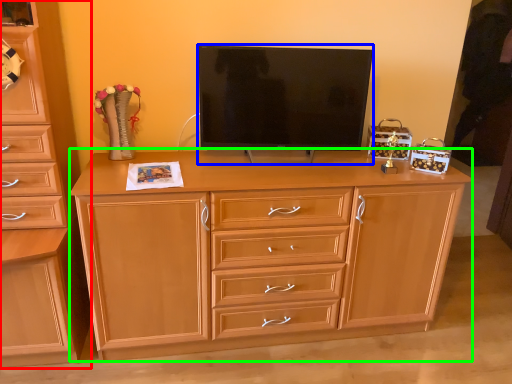
Question: Which object is the closest to the chest of drawers (highlighted by a red box)? Choose among these: television (highlighted by a blue box) or chest of drawers (highlighted by a green box).

Choices:
 (A) television
 (B) chest of drawers

Answer: (B)